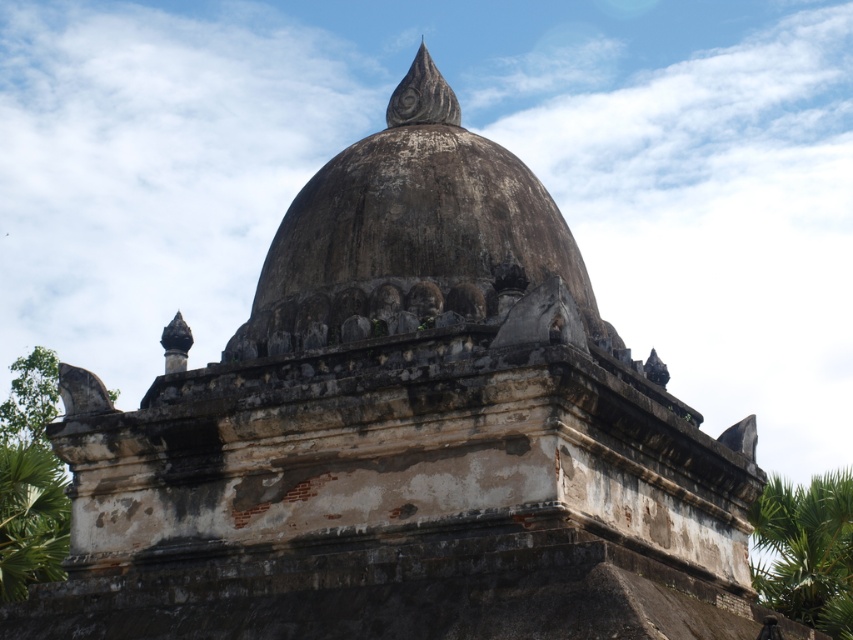
From the picture: Does green leafy palm tree at right come in front of green leafy palm tree at lower left?

No, green leafy palm tree at right is further to the viewer.

Is point (791, 577) farther from camera compared to point (45, 541)?

That is True.

Is point (830, 566) farther from camera compared to point (49, 477)?

Yes, it is.

Where is `green leafy palm tree at right`? Image resolution: width=853 pixels, height=640 pixels. green leafy palm tree at right is located at coordinates 805,548.

In the scene shown: Does weathered stone dome at center appear on the left side of green leafy palm tree at lower left?

Incorrect, weathered stone dome at center is not on the left side of green leafy palm tree at lower left.

Looking at this image, which of these two, weathered stone dome at center or green leafy palm tree at lower left, stands shorter?

green leafy palm tree at lower left is shorter.

Find the location of a particular element. weathered stone dome at center is located at coordinates (421, 243).

Where is `weathered stone dome at center`? weathered stone dome at center is located at coordinates pos(421,243).

Looking at this image, can you confirm if weathered stone dome at center is bigger than green leafy palm tree at right?

No, weathered stone dome at center is not bigger than green leafy palm tree at right.

Between weathered stone dome at center and green leafy palm tree at right, which one appears on the left side from the viewer's perspective?

weathered stone dome at center

Identify the location of weathered stone dome at center. (421, 243).